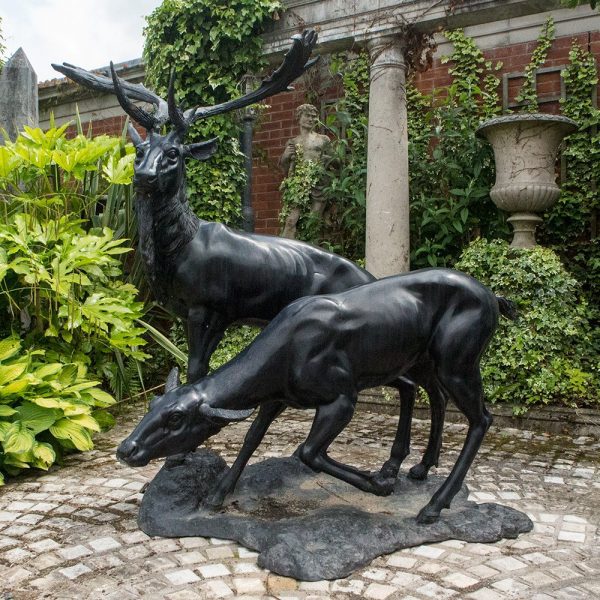
Where is `statue`? statue is located at coordinates (305, 140).